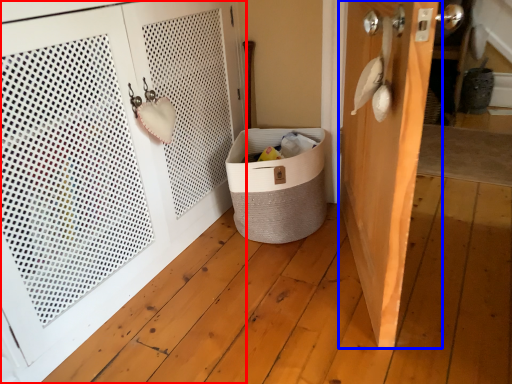
Question: Among these objects, which one is nearest to the camera, door (highlighted by a red box) or door (highlighted by a blue box)?

Choices:
 (A) door
 (B) door

Answer: (A)